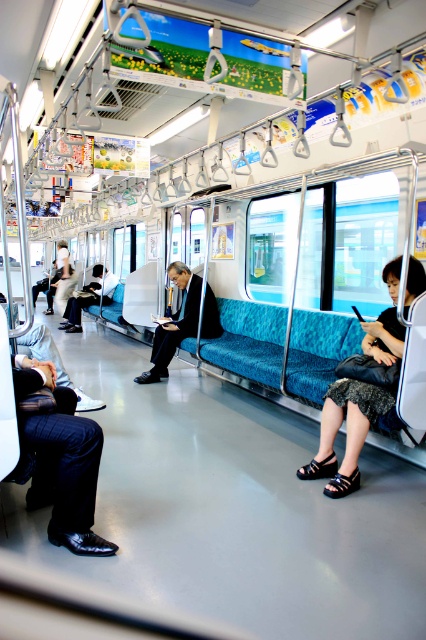
Question: Does shiny black shoe at lower left appear on the left side of black leather skirt at lower right?

Choices:
 (A) no
 (B) yes

Answer: (B)

Question: Estimate the real-world distances between objects in this image. Which object is farther from the shiny black shoe at lower left?

Choices:
 (A) smooth leather coat at center
 (B) black leather skirt at lower right

Answer: (A)

Question: Is smooth leather coat at center thinner than matte black jacket at center?

Choices:
 (A) yes
 (B) no

Answer: (B)

Question: Can you confirm if black leather skirt at lower right is positioned to the left of matte black jacket at center?

Choices:
 (A) yes
 (B) no

Answer: (B)

Question: Which point is farther from the camera taking this photo?

Choices:
 (A) (28, 451)
 (B) (163, 324)
 (C) (368, 324)

Answer: (B)

Question: Which of the following is the farthest from the observer?

Choices:
 (A) shiny black shoe at lower left
 (B) smooth leather coat at center
 (C) matte black jacket at center

Answer: (C)